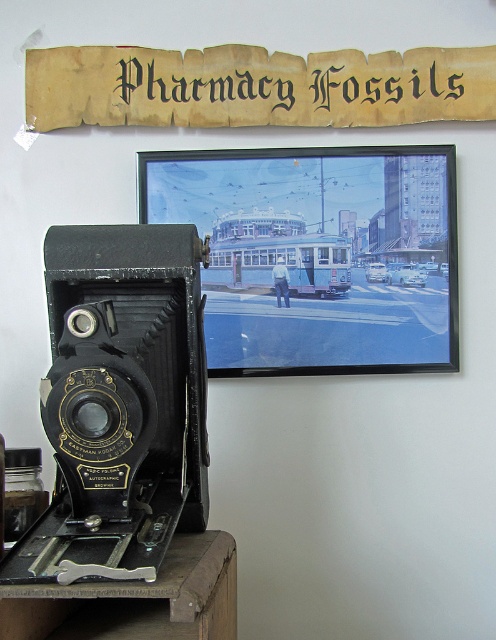
Question: Among these objects, which one is nearest to the camera?

Choices:
 (A) yellowed parchment sign at upper center
 (B) metallic silver frame at upper center

Answer: (A)

Question: Which of the following is the closest to the observer?

Choices:
 (A) (244, 99)
 (B) (430, 273)
 (C) (148, 445)

Answer: (C)

Question: Does metallic silver frame at upper center appear on the right side of matte black camera at left?

Choices:
 (A) no
 (B) yes

Answer: (B)

Question: Which object is closer to the camera taking this photo?

Choices:
 (A) matte black camera at left
 (B) metallic silver frame at upper center

Answer: (A)

Question: Can you confirm if matte black camera at left is positioned above yellowed parchment sign at upper center?

Choices:
 (A) yes
 (B) no

Answer: (B)

Question: Is matte black camera at left closer to the viewer compared to yellowed parchment sign at upper center?

Choices:
 (A) yes
 (B) no

Answer: (A)